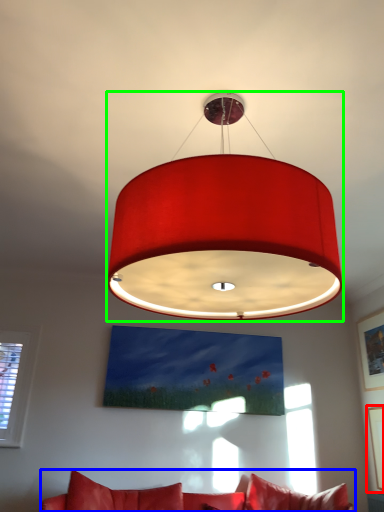
Question: Considering the real-world distances, which object is closest to picture frame (highlighted by a red box)? studio couch (highlighted by a blue box) or lamp (highlighted by a green box).

Choices:
 (A) studio couch
 (B) lamp

Answer: (A)